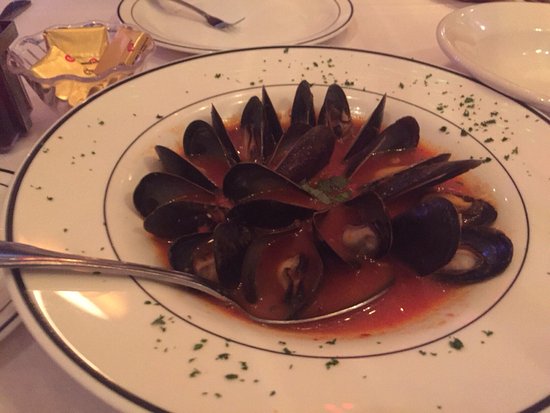
Find the location of `table cloth`. table cloth is located at coordinates (395, 22).